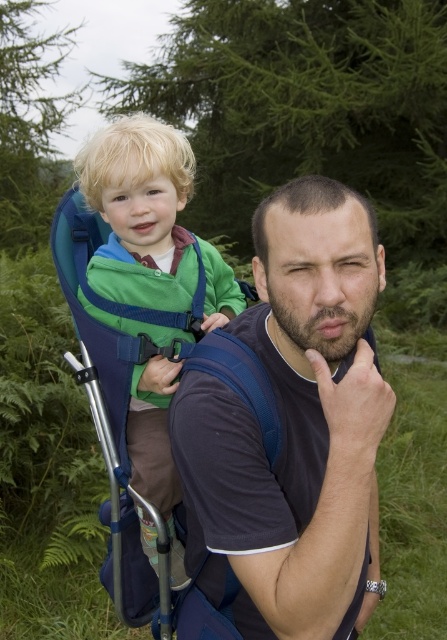
This screenshot has height=640, width=447. Find the location of `dark blue fabric shirt at center`. dark blue fabric shirt at center is located at coordinates (295, 426).

This screenshot has width=447, height=640. What do you see at coordinates (295, 426) in the screenshot? I see `dark blue fabric shirt at center` at bounding box center [295, 426].

Locate an element on the screen. dark blue fabric shirt at center is located at coordinates (295, 426).